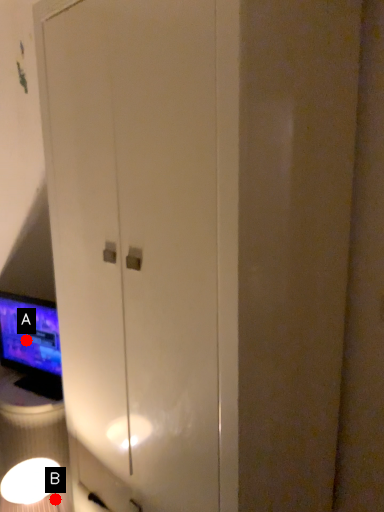
Question: Two points are circled on the image, labeled by A and B beside each circle. Which point is farther from the camera taking this photo?

Choices:
 (A) A is further
 (B) B is further

Answer: (A)